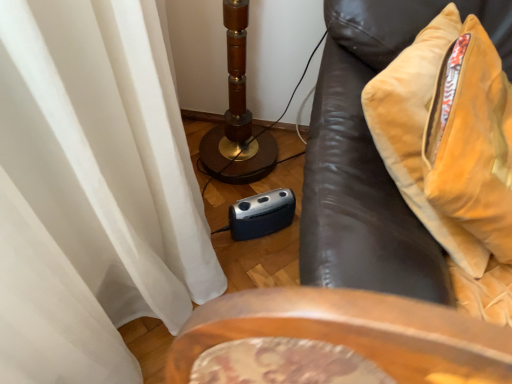
Question: Considering the relative sizes of velvet brown sofa at right and velvet yellow pillow at right in the image provided, is velvet brown sofa at right taller than velvet yellow pillow at right?

Choices:
 (A) no
 (B) yes

Answer: (B)

Question: Is velvet brown sofa at right positioned behind velvet yellow pillow at right?

Choices:
 (A) no
 (B) yes

Answer: (A)

Question: Can you confirm if velvet brown sofa at right is shorter than velvet yellow pillow at right?

Choices:
 (A) yes
 (B) no

Answer: (B)

Question: From the image's perspective, would you say velvet brown sofa at right is shown under velvet yellow pillow at right?

Choices:
 (A) yes
 (B) no

Answer: (A)

Question: Can you confirm if velvet brown sofa at right is thinner than velvet yellow pillow at right?

Choices:
 (A) no
 (B) yes

Answer: (A)

Question: Is velvet brown sofa at right wider than velvet yellow pillow at right?

Choices:
 (A) no
 (B) yes

Answer: (B)

Question: Considering the relative positions of velvet yellow pillow at right and velvet brown sofa at right in the image provided, is velvet yellow pillow at right to the left of velvet brown sofa at right from the viewer's perspective?

Choices:
 (A) no
 (B) yes

Answer: (B)

Question: Can you confirm if velvet yellow pillow at right is positioned to the right of velvet brown sofa at right?

Choices:
 (A) yes
 (B) no

Answer: (B)

Question: Does velvet yellow pillow at right have a lesser width compared to velvet brown sofa at right?

Choices:
 (A) yes
 (B) no

Answer: (A)

Question: Is velvet yellow pillow at right with velvet brown sofa at right?

Choices:
 (A) yes
 (B) no

Answer: (A)

Question: Can you confirm if velvet yellow pillow at right is taller than velvet brown sofa at right?

Choices:
 (A) yes
 (B) no

Answer: (B)

Question: Is velvet yellow pillow at right surrounding velvet brown sofa at right?

Choices:
 (A) yes
 (B) no

Answer: (B)

Question: Is velvet brown sofa at right bigger or smaller than velvet yellow pillow at right?

Choices:
 (A) big
 (B) small

Answer: (A)